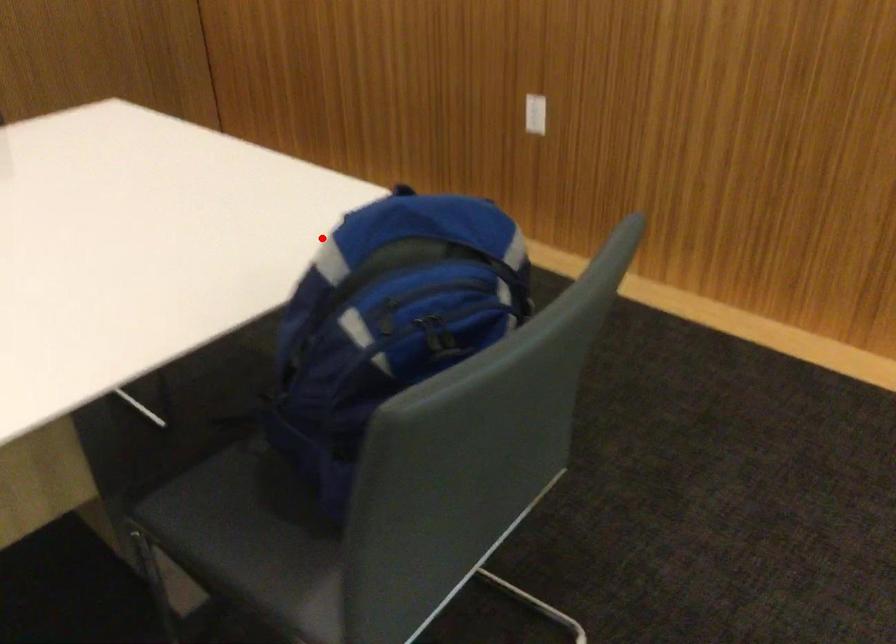
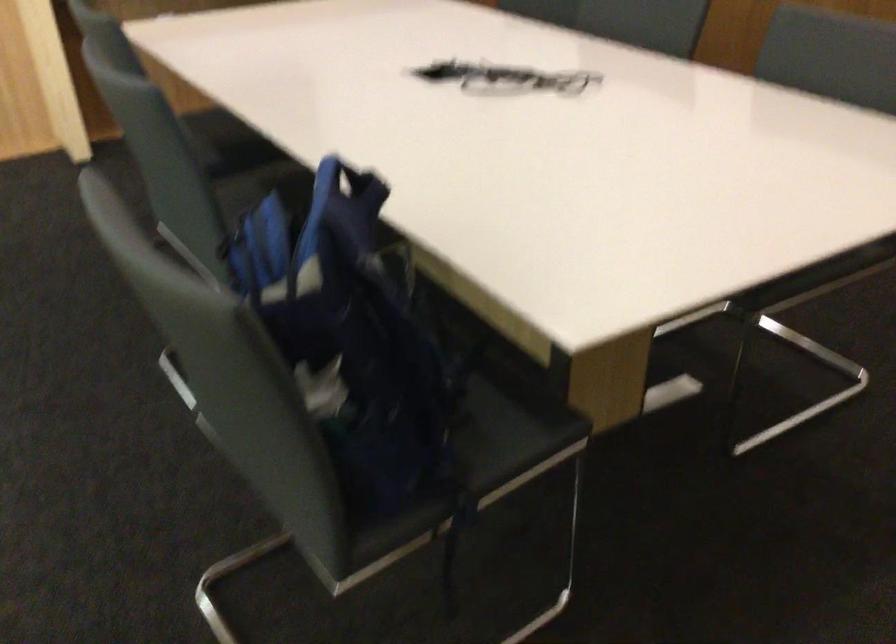
Question: I am providing you with two images of the same scene from different viewpoints. Image1 has a red point marked. In image2, the corresponding 3D location appears at what relative position? Reply with the corresponding letter.

Choices:
 (A) Closer
 (B) Farther

Answer: (B)